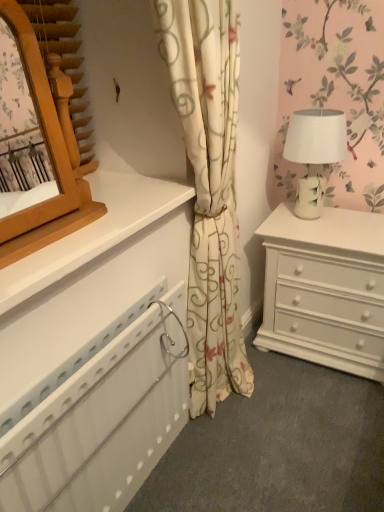
This screenshot has width=384, height=512. Identify the location of vacant space to the right of white ceramic table lamp at right. (362, 217).